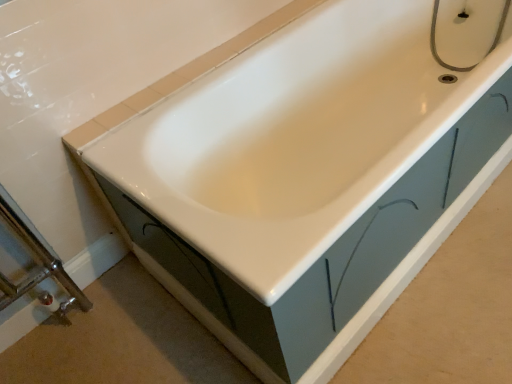
Question: Looking at the image, does brushed metal shower door at lower left seem bigger or smaller compared to matte silver faucet at upper right?

Choices:
 (A) small
 (B) big

Answer: (B)

Question: Looking at their shapes, would you say brushed metal shower door at lower left is wider or thinner than matte silver faucet at upper right?

Choices:
 (A) thin
 (B) wide

Answer: (A)

Question: Considering their positions, is brushed metal shower door at lower left located in front of or behind matte silver faucet at upper right?

Choices:
 (A) behind
 (B) front

Answer: (B)

Question: Considering the positions of matte silver faucet at upper right and brushed metal shower door at lower left in the image, is matte silver faucet at upper right taller or shorter than brushed metal shower door at lower left?

Choices:
 (A) short
 (B) tall

Answer: (A)

Question: Is matte silver faucet at upper right inside or outside of brushed metal shower door at lower left?

Choices:
 (A) inside
 (B) outside

Answer: (B)

Question: Considering the positions of point (472, 67) and point (1, 187), is point (472, 67) closer or farther from the camera than point (1, 187)?

Choices:
 (A) closer
 (B) farther

Answer: (A)

Question: From the image's perspective, is matte silver faucet at upper right above or below brushed metal shower door at lower left?

Choices:
 (A) below
 (B) above

Answer: (B)